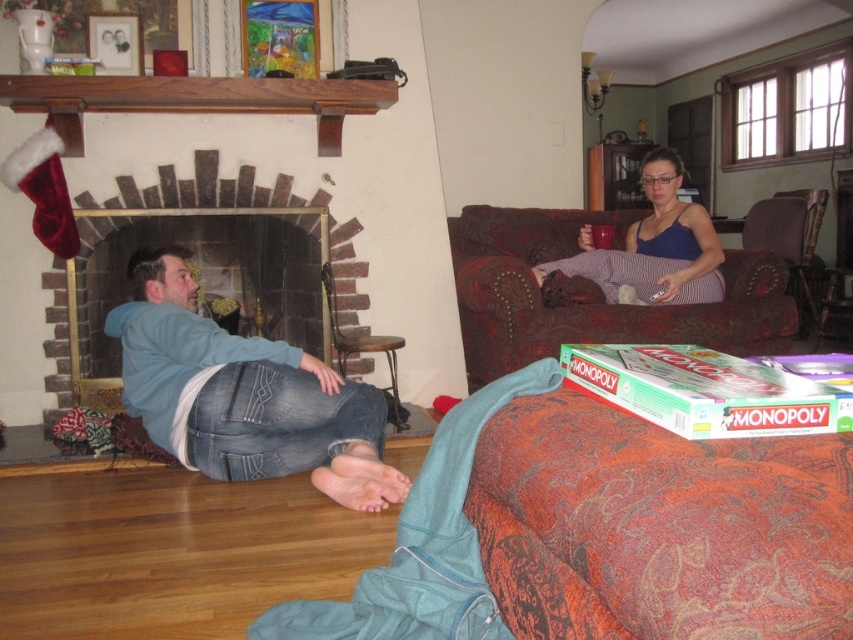
Does blue denim jeans at lower left come in front of dark brown leather armchair at right?

Yes, it is.

Which of these two, blue denim jeans at lower left or dark brown leather armchair at right, stands taller?

dark brown leather armchair at right is taller.

Which is behind, point (247, 445) or point (807, 244)?

The point (807, 244) is more distant.

Where is `blue denim jeans at lower left`? Image resolution: width=853 pixels, height=640 pixels. blue denim jeans at lower left is located at coordinates (244, 394).

Which is in front, point (310, 422) or point (485, 308)?

Positioned in front is point (310, 422).

Does blue denim jeans at lower left have a smaller size compared to velvet-like brown couch at upper right?

Yes, blue denim jeans at lower left is smaller than velvet-like brown couch at upper right.

Does point (381, 420) lie in front of point (581, 291)?

Yes, point (381, 420) is in front of point (581, 291).

This screenshot has width=853, height=640. I want to click on blue denim jeans at lower left, so click(244, 394).

Between brick fireplace at left and dark brown leather armchair at right, which one has more height?

With more height is brick fireplace at left.

Which is behind, point (264, 232) or point (811, 216)?

The point (811, 216) is behind.

The image size is (853, 640). Identify the location of brick fireplace at left. (202, 269).